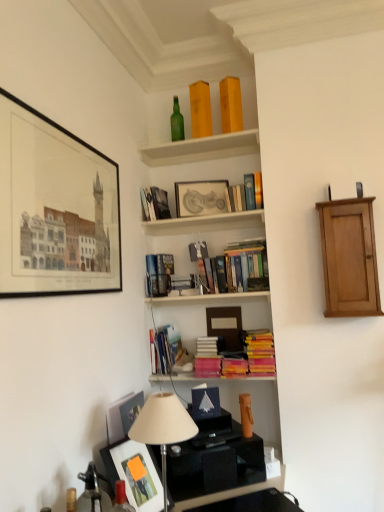
Identify the location of free space that is in between green glass bottle at upper center and matte yellow book at upper center, the 2th book positioned from the top. The height and width of the screenshot is (512, 384). coord(189,147).